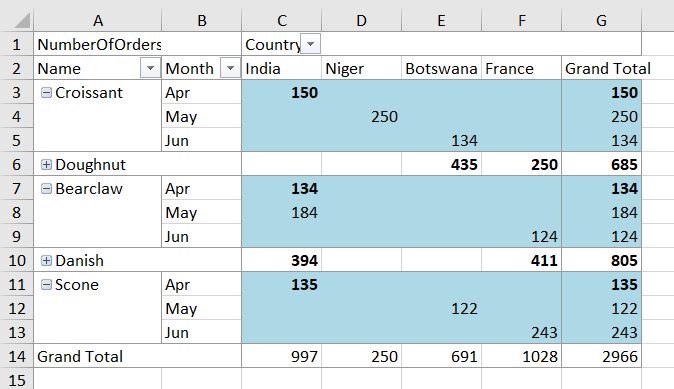
Find the location of `columns`. columns is located at coordinates (98, 7), (193, 9), (280, 23), (360, 22), (419, 25), (520, 20), (594, 21).